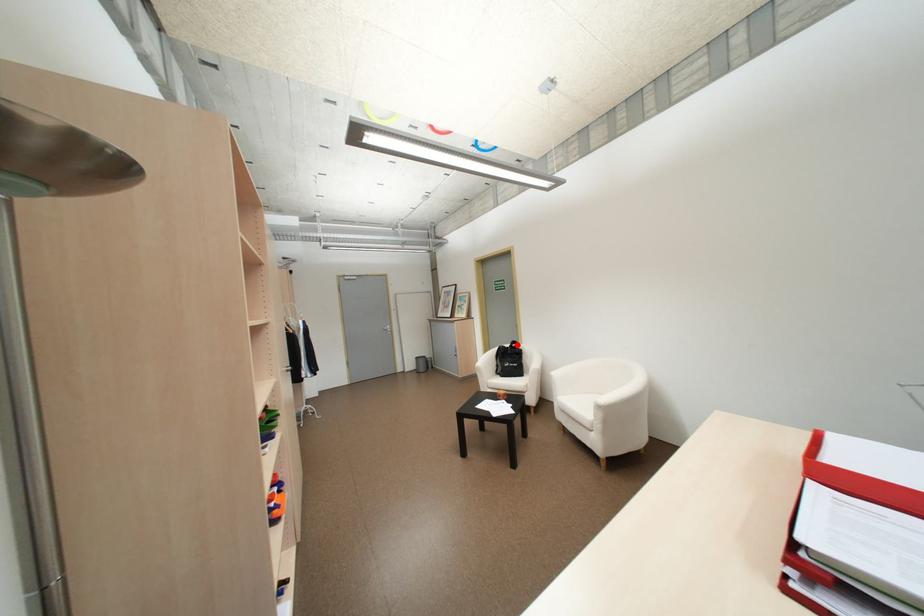
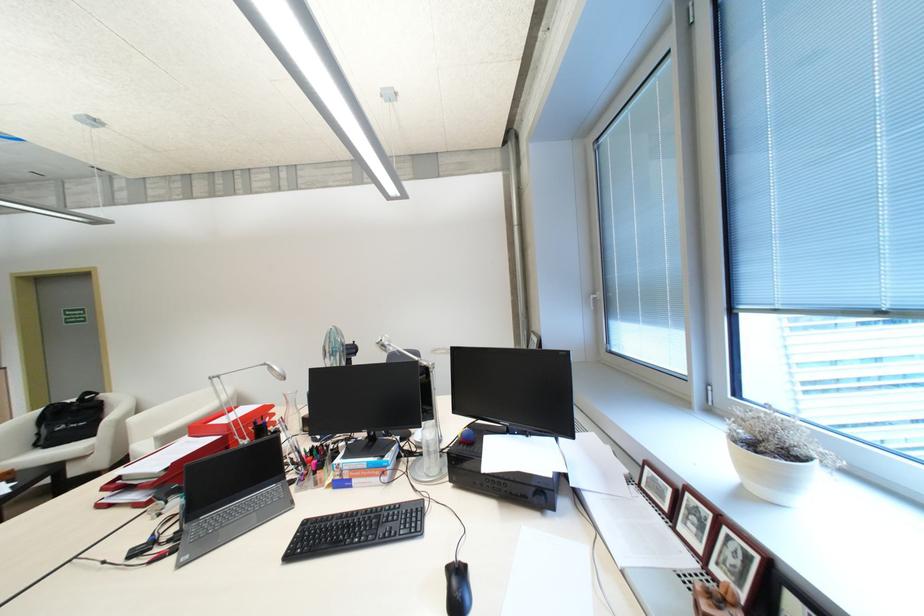
Question: I am providing you with two images of the same scene from different viewpoints. Image1 has a red point marked. In image2, the corresponding 3D location appears at what relative position? Reply with the corresponding letter.

Choices:
 (A) Closer
 (B) Farther

Answer: (A)